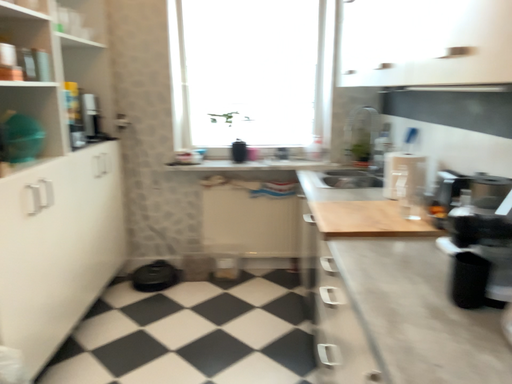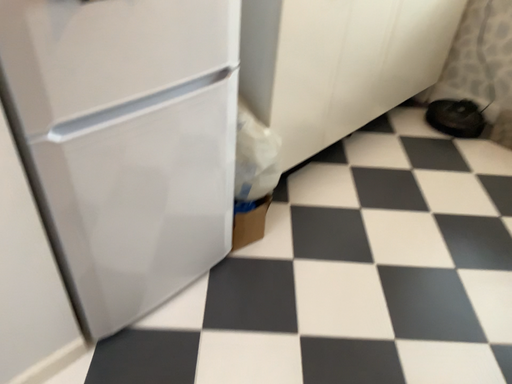
Question: How did the camera likely rotate when shooting the video?

Choices:
 (A) rotated left
 (B) rotated right

Answer: (A)